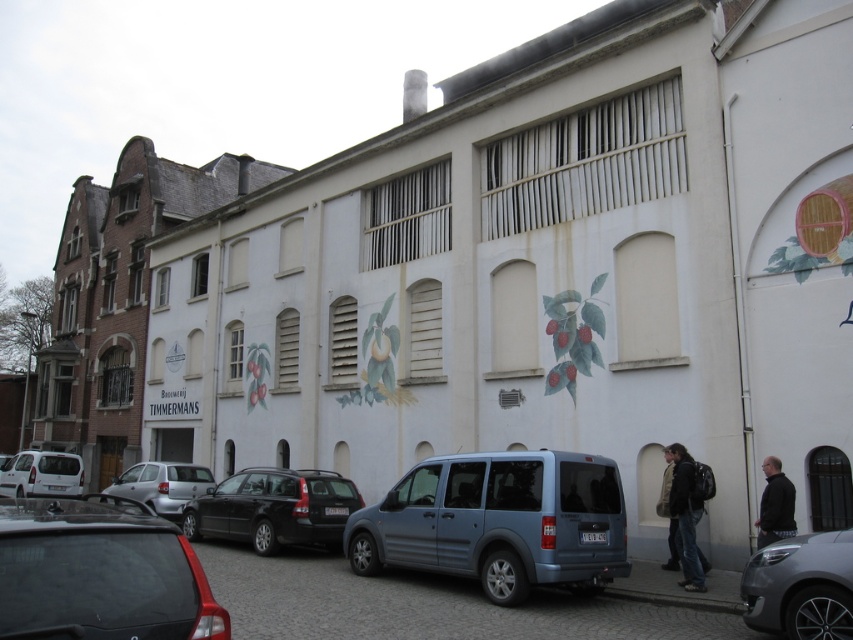
Question: Is shiny black sedan at lower left thinner than satin silver van at lower right?

Choices:
 (A) no
 (B) yes

Answer: (A)

Question: Estimate the real-world distances between objects in this image. Which object is farther from the black matte jacket at lower right?

Choices:
 (A) leather jacket at lower right
 (B) white matte van at lower left

Answer: (B)

Question: Can you confirm if silver metallic car at lower left is smaller than leather jacket at lower right?

Choices:
 (A) no
 (B) yes

Answer: (A)

Question: Which point is farther from the camera taking this photo?

Choices:
 (A) (796, 536)
 (B) (61, 458)

Answer: (B)

Question: Does satin silver van at lower right have a greater width compared to silver metallic car at lower left?

Choices:
 (A) yes
 (B) no

Answer: (B)

Question: Based on their relative distances, which object is farther from the shiny black sedan at lower left?

Choices:
 (A) black matte station wagon at center
 (B) satin silver van at lower right

Answer: (A)